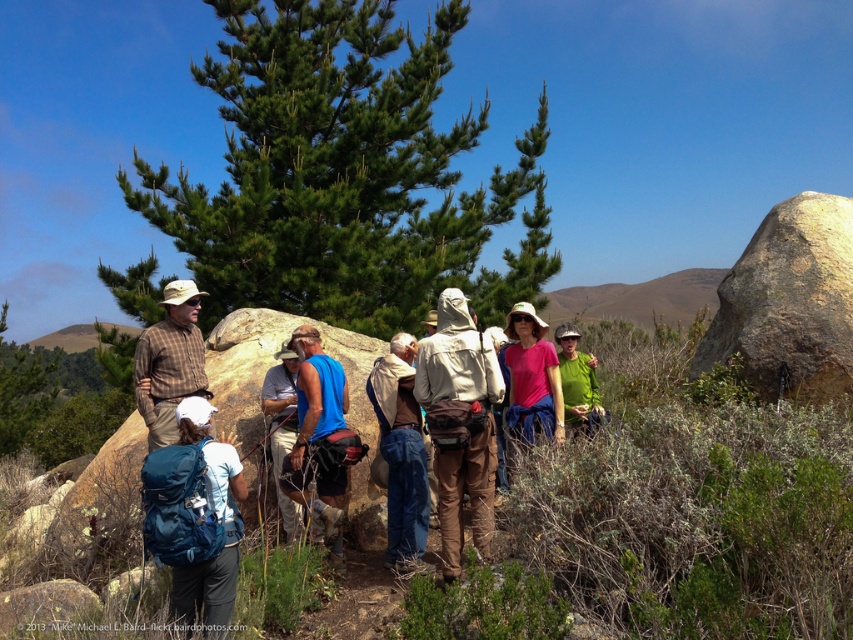
Question: Does blue fabric backpack at lower left appear on the left side of plaid fabric shirt at center?

Choices:
 (A) yes
 (B) no

Answer: (B)

Question: Estimate the real-world distances between objects in this image. Which object is closer to the brown canvas backpack at center?

Choices:
 (A) pink fabric shirt at center
 (B) blue fabric backpack at lower left
 (C) green needle-like pine at center
 (D) brown leather backpack at center

Answer: (A)

Question: Which is farther from the green matte shirt at center?

Choices:
 (A) green needle-like pine at center
 (B) blue fabric backpack at lower left
 (C) plaid fabric shirt at center
 (D) brown suede jacket at center

Answer: (A)

Question: Is brown suede jacket at center below plaid fabric shirt at center?

Choices:
 (A) no
 (B) yes

Answer: (B)

Question: Which of the following is the farthest from the observer?

Choices:
 (A) brown suede jacket at center
 (B) pink fabric shirt at center
 (C) plaid fabric shirt at center

Answer: (C)

Question: In this image, where is blue fabric shirt at center located relative to pink fabric shirt at center?

Choices:
 (A) left
 (B) right

Answer: (A)